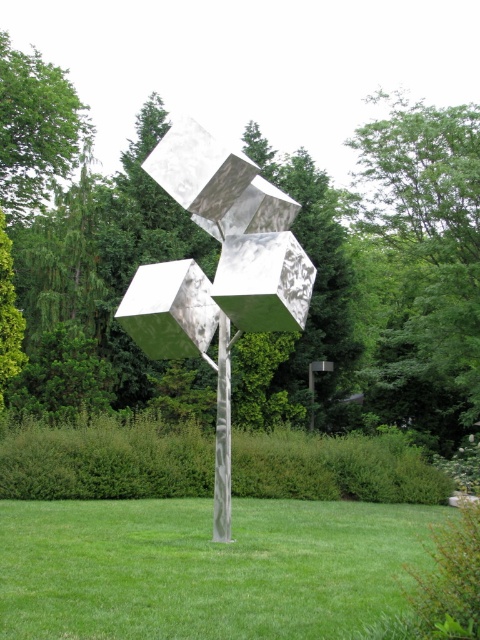
Question: Is metallic cubes at center to the right of green leafy tree at upper left from the viewer's perspective?

Choices:
 (A) yes
 (B) no

Answer: (A)

Question: Which of these objects is positioned closest to the metallic cubes at center?

Choices:
 (A) green grass at center
 (B) metallic polished pole at center
 (C) green leafy tree at upper left
 (D) green leafy tree at upper center

Answer: (B)

Question: Which of these objects is positioned closest to the green leafy tree at center?

Choices:
 (A) metallic polished pole at center
 (B) green leafy tree at upper left
 (C) green leafy tree at upper center
 (D) green grass at center

Answer: (C)

Question: Is green grass at center positioned behind metallic cubes at center?

Choices:
 (A) yes
 (B) no

Answer: (B)

Question: Which object is closer to the camera taking this photo?

Choices:
 (A) green grass at center
 (B) metallic cubes at center
 (C) green leafy tree at center
 (D) green leafy tree at upper center

Answer: (A)

Question: Is metallic cubes at center thinner than metallic polished pole at center?

Choices:
 (A) no
 (B) yes

Answer: (A)